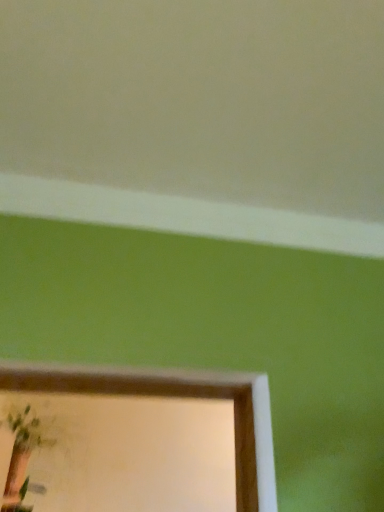
This screenshot has height=512, width=384. Describe the element at coordinates (22, 457) in the screenshot. I see `green matte vase at lower left` at that location.

The width and height of the screenshot is (384, 512). Identify the location of green matte vase at lower left. (22, 457).

Locate an element on the screen. The width and height of the screenshot is (384, 512). green matte vase at lower left is located at coordinates (22, 457).